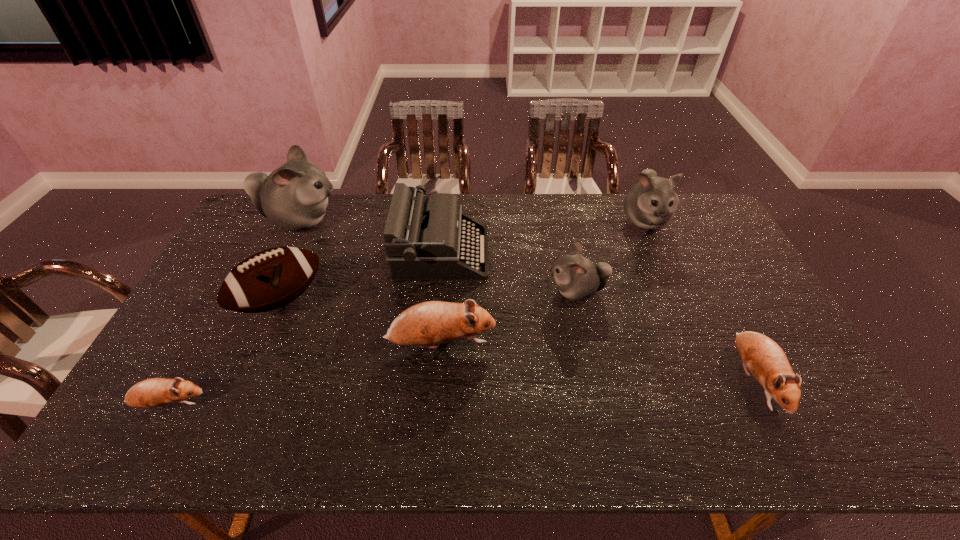
This screenshot has width=960, height=540. I want to click on unoccupied position between the second tallest hamster and the typewriter, so click(543, 236).

Locate an element on the screen. Image resolution: width=960 pixels, height=540 pixels. empty location between the typewriter and the football (American) is located at coordinates (361, 276).

Choose which object is the sixth nearest neighbor to the biggest white hamster. Please provide its 2D coordinates. Your answer should be formatted as a tuple, i.e. [(x, y)], where the tuple contains the x and y coordinates of a point satisfying the conditions above.

[(651, 203)]

Identify which object is the fifth nearest to the fifth shortest hamster. Please provide its 2D coordinates. Your answer should be formatted as a tuple, i.e. [(x, y)], where the tuple contains the x and y coordinates of a point satisfying the conditions above.

[(270, 279)]

Locate which hamster ranks third in proximity to the football (American). Please provide its 2D coordinates. Your answer should be formatted as a tuple, i.e. [(x, y)], where the tuple contains the x and y coordinates of a point satisfying the conditions above.

[(432, 322)]

Choose which hamster is the nearest neighbor to the second shortest hamster. Please provide its 2D coordinates. Your answer should be formatted as a tuple, i.e. [(x, y)], where the tuple contains the x and y coordinates of a point satisfying the conditions above.

[(577, 278)]

Identify which white hamster is the second closest to the nearest white hamster. Please provide its 2D coordinates. Your answer should be formatted as a tuple, i.e. [(x, y)], where the tuple contains the x and y coordinates of a point satisfying the conditions above.

[(294, 197)]

The height and width of the screenshot is (540, 960). Identify the location of white hamster that stands as the third closest to the shortest hamster. (651, 203).

At what (x,y) coordinates should I click in order to perform the action: click on the second closest brown hamster to the rightmost brown hamster. Please return your answer as a coordinate pair (x, y). The width and height of the screenshot is (960, 540). Looking at the image, I should click on (154, 392).

Identify the location of brown hamster object that ranks as the closest to the leftmost white hamster. click(x=432, y=322).